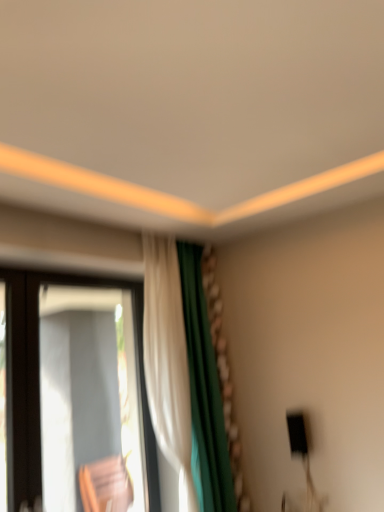
Question: Considering the positions of transparent glass window at left and white fabric curtain at center in the image, is transparent glass window at left taller or shorter than white fabric curtain at center?

Choices:
 (A) short
 (B) tall

Answer: (A)

Question: Based on their sizes in the image, would you say transparent glass window at left is bigger or smaller than white fabric curtain at center?

Choices:
 (A) big
 (B) small

Answer: (B)

Question: Is transparent glass window at left wider or thinner than white fabric curtain at center?

Choices:
 (A) thin
 (B) wide

Answer: (A)

Question: Based on their sizes in the image, would you say white fabric curtain at center is bigger or smaller than transparent glass window at left?

Choices:
 (A) big
 (B) small

Answer: (A)

Question: Is point (148, 264) positioned closer to the camera than point (3, 271)?

Choices:
 (A) farther
 (B) closer

Answer: (A)

Question: Relative to transparent glass window at left, is white fabric curtain at center in front or behind?

Choices:
 (A) behind
 (B) front

Answer: (A)

Question: Would you say white fabric curtain at center is to the left or to the right of transparent glass window at left in the picture?

Choices:
 (A) left
 (B) right

Answer: (B)